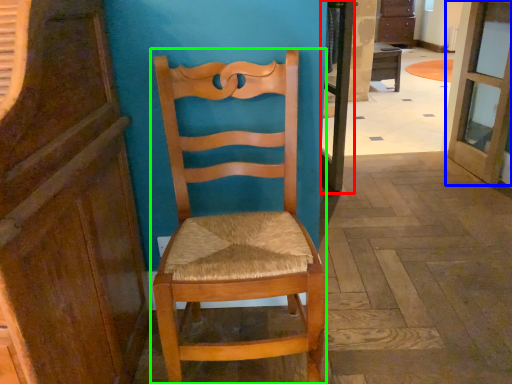
Question: Which object is positioned farthest from screen door (highlighted by a red box)? Select from door (highlighted by a blue box) and chair (highlighted by a green box).

Choices:
 (A) door
 (B) chair

Answer: (B)